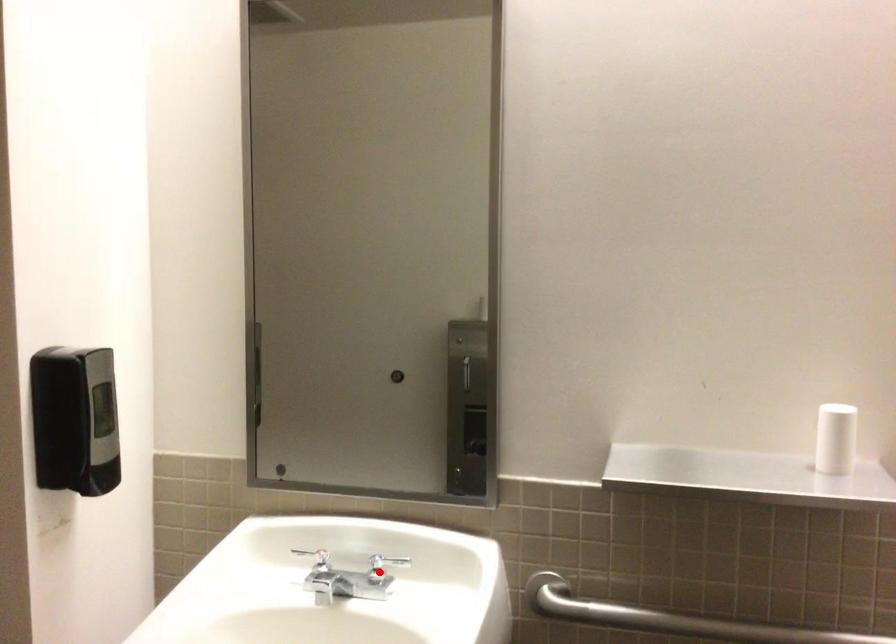
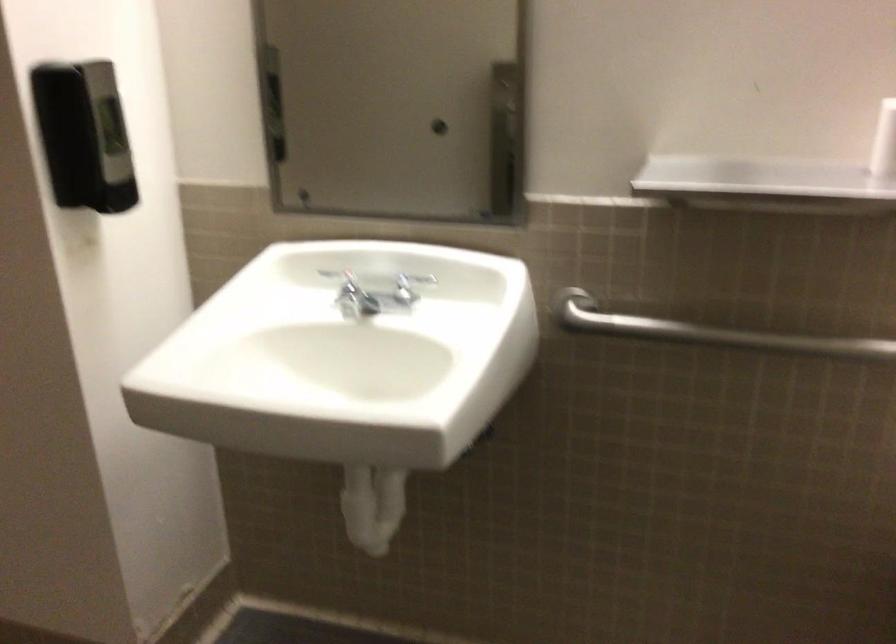
The point at the highlighted location is marked in the first image. Where is the corresponding point in the second image?

(403, 290)